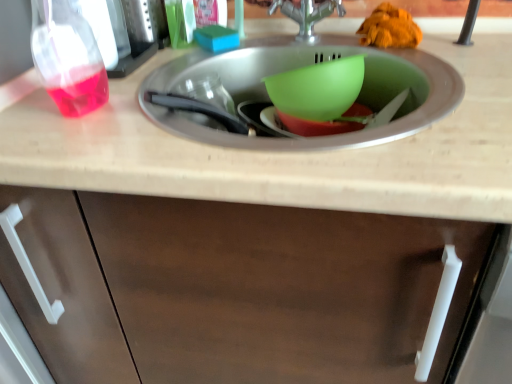
You are a GUI agent. You are given a task and a screenshot of the screen. Output one action in this format:
    pyautogui.click(x=<x>, y=<y>)
    Task: Click on the free space between blue sponge at upper center, the 1th food positioned from the left, and transparent plastic bottle at left
    
    Given the screenshot: What is the action you would take?
    pyautogui.click(x=174, y=73)